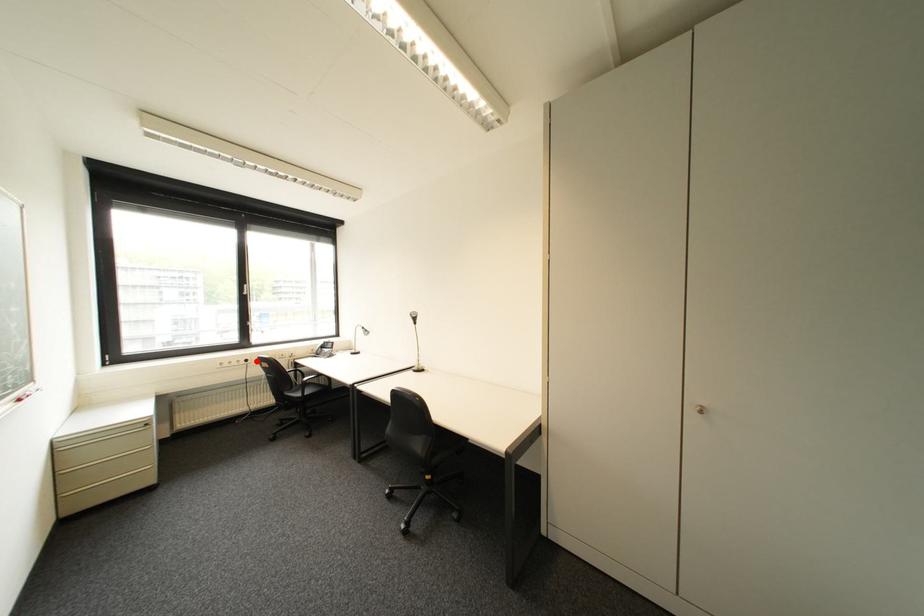
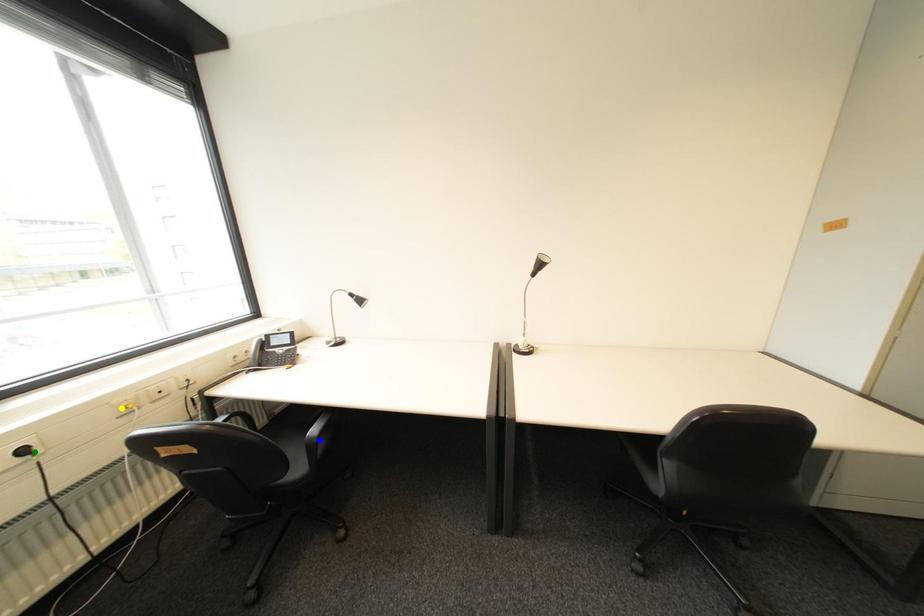
Question: I am providing you with two images of the same scene from different viewpoints. A red point is marked on the first image. You are given multiple points on the second image. In image 2, which mark is for the same physical point as the one in image 1?

Choices:
 (A) green point
 (B) yellow point
 (C) blue point

Answer: (A)